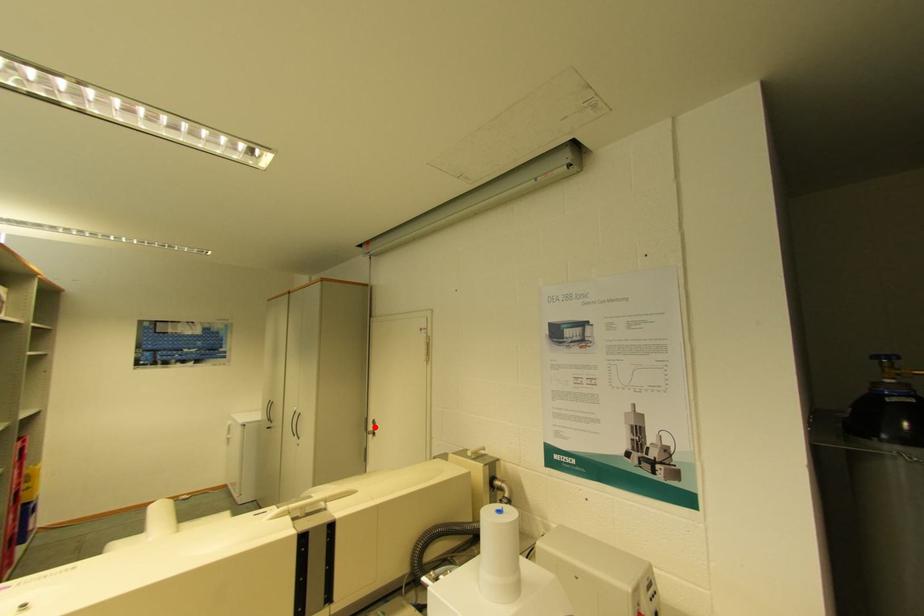
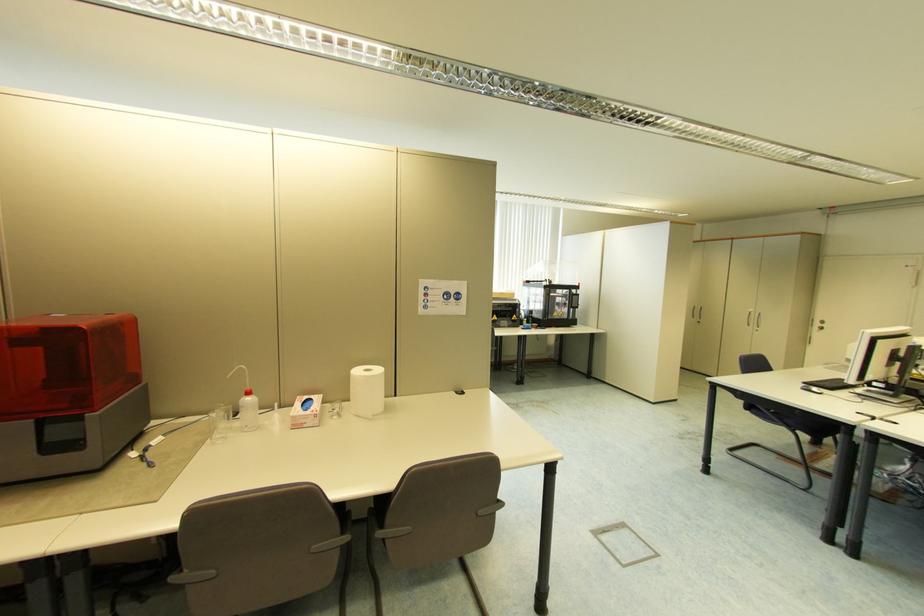
Question: I am providing you with two images of the same scene from different viewpoints. Image1 has a red point marked. In image2, the corresponding 3D location appears at what relative position? Reply with the corresponding letter.

Choices:
 (A) Closer
 (B) Farther

Answer: (B)